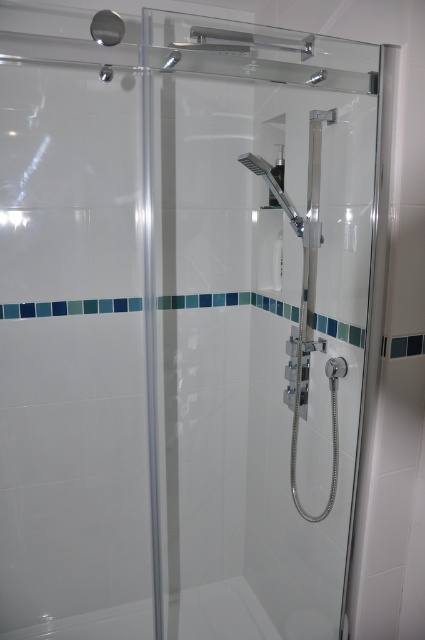
Question: Can you confirm if white glossy bath at lower center is thinner than chrome metallic shower head at upper center?

Choices:
 (A) no
 (B) yes

Answer: (A)

Question: Does white glossy bath at lower center have a smaller size compared to chrome metallic shower head at upper center?

Choices:
 (A) no
 (B) yes

Answer: (A)

Question: Among these points, which one is nearest to the camera?

Choices:
 (A) (280, 205)
 (B) (215, 609)

Answer: (A)

Question: Is white glossy bath at lower center above chrome metallic shower head at upper center?

Choices:
 (A) yes
 (B) no

Answer: (B)

Question: Which object appears closest to the camera in this image?

Choices:
 (A) chrome metallic shower head at upper center
 (B) white glossy bath at lower center

Answer: (A)